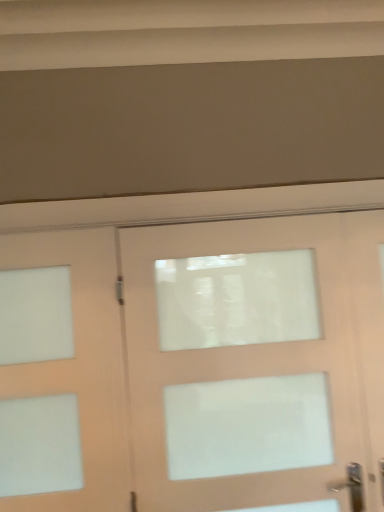
Question: Is point (324, 442) positioned closer to the camera than point (100, 374)?

Choices:
 (A) farther
 (B) closer

Answer: (A)

Question: Is white matte door at center, arranged as the second door when viewed from the left, bigger or smaller than matte white door at left, acting as the first door starting from the left?

Choices:
 (A) big
 (B) small

Answer: (A)

Question: In terms of width, does white matte door at center, arranged as the second door when viewed from the left, look wider or thinner when compared to matte white door at left, acting as the first door starting from the left?

Choices:
 (A) wide
 (B) thin

Answer: (A)

Question: In the image, is matte white door at left, arranged as the 2th door when viewed from the right, on the left side or the right side of white matte door at center, acting as the first door starting from the right?

Choices:
 (A) left
 (B) right

Answer: (A)

Question: In terms of height, does matte white door at left, arranged as the 2th door when viewed from the right, look taller or shorter compared to white matte door at center, arranged as the second door when viewed from the left?

Choices:
 (A) short
 (B) tall

Answer: (A)

Question: Relative to white matte door at center, acting as the first door starting from the right, is matte white door at left, acting as the first door starting from the left, in front or behind?

Choices:
 (A) behind
 (B) front

Answer: (A)

Question: Is point (59, 234) positioned closer to the camera than point (294, 464)?

Choices:
 (A) farther
 (B) closer

Answer: (A)